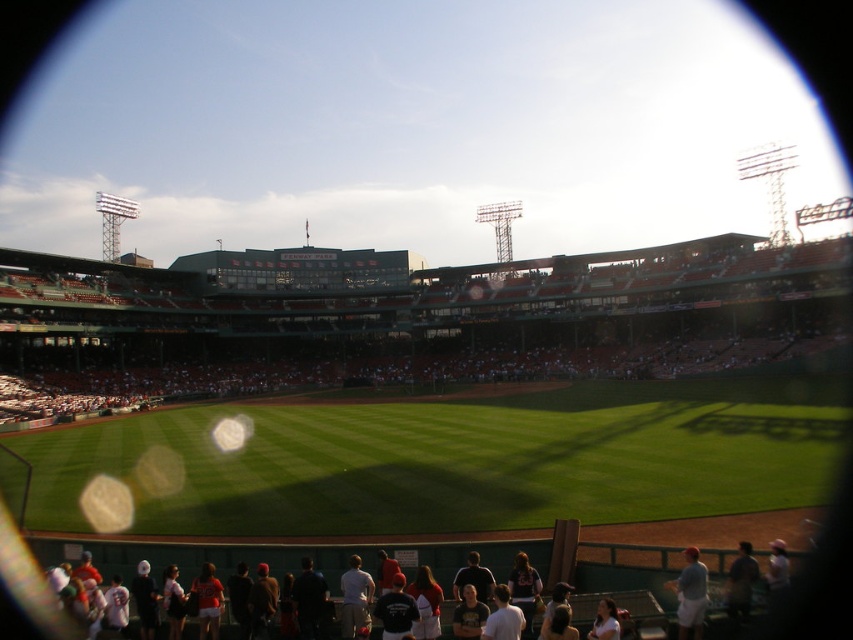
You are at Fenway Park and want to find the best spot to take a photo of both the point at coordinates point (367, 620) and the point at coordinates point (611, 614). According to the scene description, which point should you stand behind to ensure both are visible in your shot?

You should stand behind point (611, 614) because point (367, 620) is behind it, so standing behind point (611, 614) will allow you to see both points in your photo.

You are a photographer at Fenway Park and want to capture a photo of the two shirts mentioned. Since the light blue fabric shirt at lower right is taller than the dark blue shirt at lower right, which one should you focus on to ensure both shirts are fully visible in the frame?

The light blue fabric shirt at lower right is taller than the dark blue shirt at lower right, so focusing on the light blue fabric shirt at lower right will ensure both shirts are fully visible in the frame.